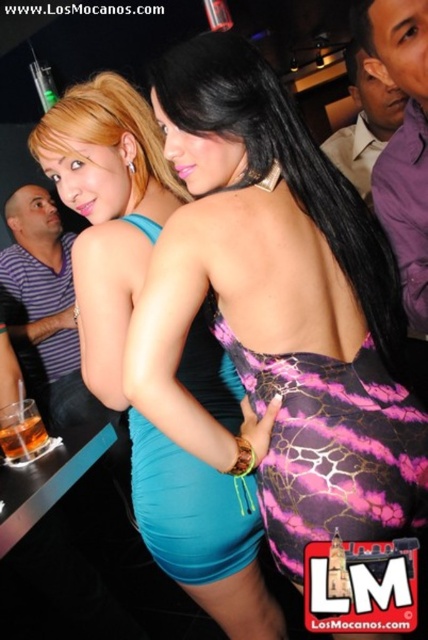
Question: Which point is closer to the camera?

Choices:
 (A) (64, 323)
 (B) (330, 509)

Answer: (B)

Question: Does striped shirt at left appear over translucent glass drink at lower left?

Choices:
 (A) no
 (B) yes

Answer: (B)

Question: Which object appears farthest from the camera in this image?

Choices:
 (A) blue satin dress at center
 (B) pink leopard print dress at back

Answer: (A)

Question: Can you confirm if blue satin dress at center is smaller than pink leopard print dress at back?

Choices:
 (A) yes
 (B) no

Answer: (B)

Question: Can you confirm if blue satin dress at center is positioned to the right of translucent glass drink at lower left?

Choices:
 (A) yes
 (B) no

Answer: (A)

Question: Which object is the farthest from the blue satin dress at center?

Choices:
 (A) pink leopard print dress at back
 (B) teal satin dress at center
 (C) purple shirt at upper right

Answer: (C)